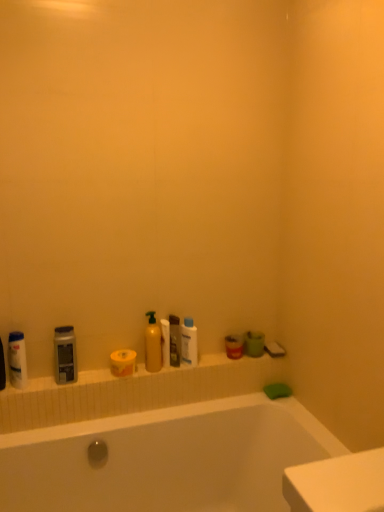
The height and width of the screenshot is (512, 384). I want to click on vacant space situated on the left part of yellow matte toilet paper at center, marked as the second toilet paper in a right-to-left arrangement, so point(90,378).